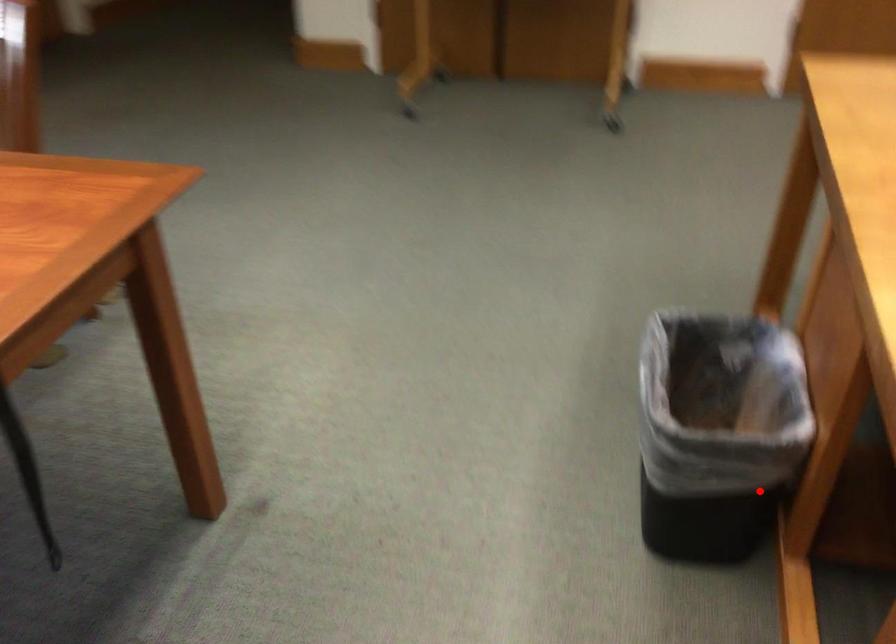
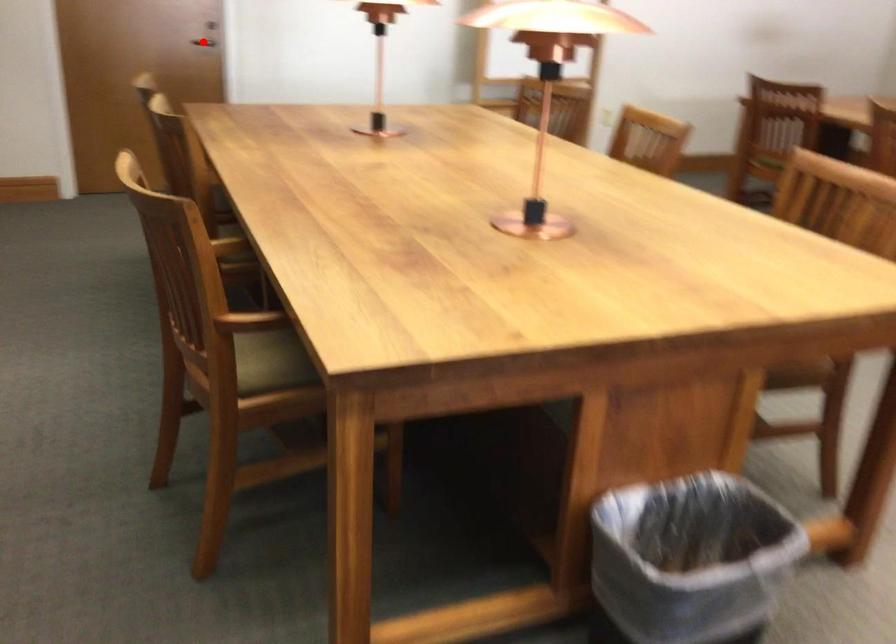
I am providing you with two images of the same scene from different viewpoints. A red point is marked on the first image and another point is marked on the second image. Is the marked point in image1 the same physical position as the marked point in image2?

No